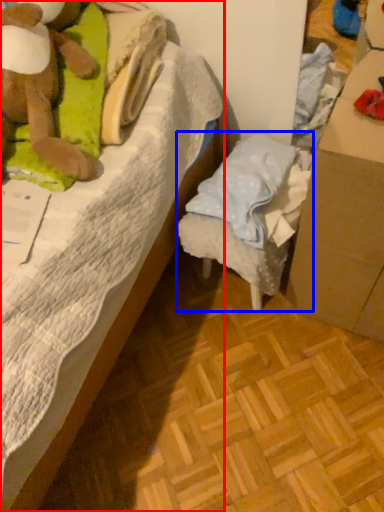
Question: Which object is further to the camera taking this photo, bed (highlighted by a red box) or furniture (highlighted by a blue box)?

Choices:
 (A) bed
 (B) furniture

Answer: (B)